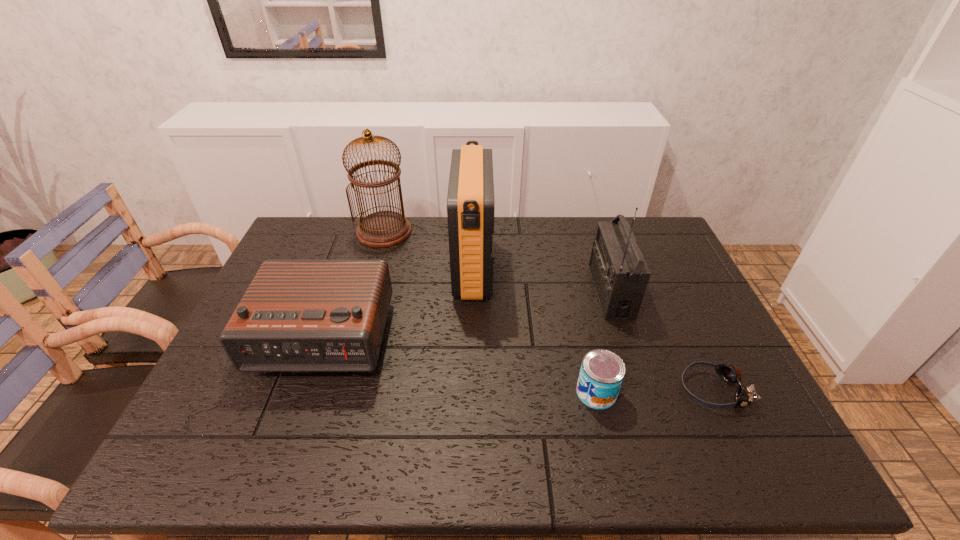
Find the location of `radio receiver present at the far edge`. radio receiver present at the far edge is located at coordinates (470, 201).

Identify the location of object that is at the left edge. (297, 315).

In order to click on object that is positioned at the right edge in this screenshot , I will do `click(731, 374)`.

Locate an element on the screen. This screenshot has width=960, height=540. free space at the far edge of the desktop is located at coordinates (510, 246).

You are a GUI agent. You are given a task and a screenshot of the screen. Output one action in this format:
    pyautogui.click(x=<x>, y=<y>)
    Task: Click on the vacant space at the left edge of the desktop
    
    Given the screenshot: What is the action you would take?
    pyautogui.click(x=202, y=420)

The height and width of the screenshot is (540, 960). I want to click on vacant space at the right edge of the desktop, so click(695, 331).

This screenshot has height=540, width=960. What are the coordinates of `free space at the far left corner of the desktop` in the screenshot? It's located at (290, 245).

Identify the location of vacant space at the far right corner. (641, 221).

I want to click on free point between the third shortest object and the third object from right to left, so click(458, 365).

Where is `free point between the shortest object and the third object from right to left`? The image size is (960, 540). free point between the shortest object and the third object from right to left is located at coordinates (655, 391).